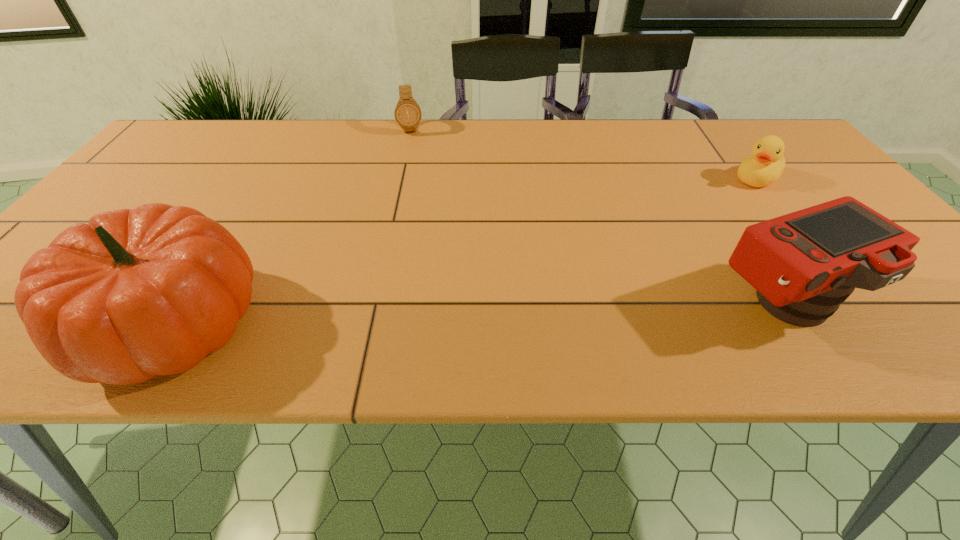
Locate an element on the screen. vacant space located 0.230m on the face of the watch is located at coordinates (x=417, y=182).

Locate an element on the screen. The width and height of the screenshot is (960, 540). free space located on the face of the watch is located at coordinates (415, 165).

The width and height of the screenshot is (960, 540). I want to click on free space located on the face of the watch, so click(418, 201).

Where is `object situated at the far edge`? object situated at the far edge is located at coordinates (407, 112).

Where is `pumpkin at the near edge`? The image size is (960, 540). pumpkin at the near edge is located at coordinates (135, 293).

The width and height of the screenshot is (960, 540). In order to click on camera situated at the near edge in this screenshot , I will do `click(803, 265)`.

Find the location of a particular element. Image resolution: width=960 pixels, height=540 pixels. object at the right edge is located at coordinates (766, 165).

You are a GUI agent. You are given a task and a screenshot of the screen. Output one action in this format:
    pyautogui.click(x=<x>, y=<y>)
    Task: Click on the free space at the far edge
    This screenshot has width=960, height=540.
    Given the screenshot: What is the action you would take?
    pyautogui.click(x=429, y=148)

Where is `vacant region at the near edge of the desktop`? vacant region at the near edge of the desktop is located at coordinates (298, 293).

Where is `vacant region at the right edge of the desktop`? This screenshot has width=960, height=540. vacant region at the right edge of the desktop is located at coordinates (808, 182).